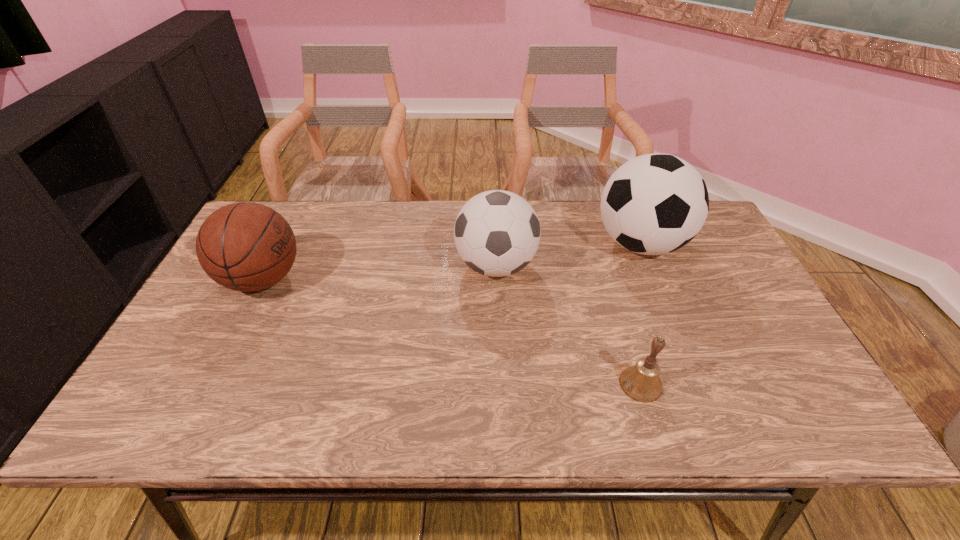
You are a GUI agent. You are given a task and a screenshot of the screen. Output one action in this format:
    pyautogui.click(x=<x>, y=<y>)
    Task: Click on the taller soccer ball
    The width and height of the screenshot is (960, 540).
    Given the screenshot: What is the action you would take?
    pyautogui.click(x=654, y=204)

Identify the location of the tallest object. (654, 204).

I want to click on the shorter soccer ball, so click(x=497, y=233).

Find the location of `the third object from right to left`. the third object from right to left is located at coordinates (497, 233).

I want to click on the leftmost object, so click(x=244, y=246).

The width and height of the screenshot is (960, 540). Find the location of `bell`. bell is located at coordinates (641, 382).

What are the coordinates of `the nearest object` in the screenshot? It's located at (641, 382).

Identify the location of free spot located 0.050m on the right of the taller soccer ball. The width and height of the screenshot is (960, 540). (704, 244).

The width and height of the screenshot is (960, 540). In order to click on free space located 0.310m on the front of the shorter soccer ball in this screenshot , I will do `click(501, 397)`.

Find the location of a particular element. This screenshot has width=960, height=540. free space located 0.210m on the side with brand label of the leftmost object is located at coordinates (379, 279).